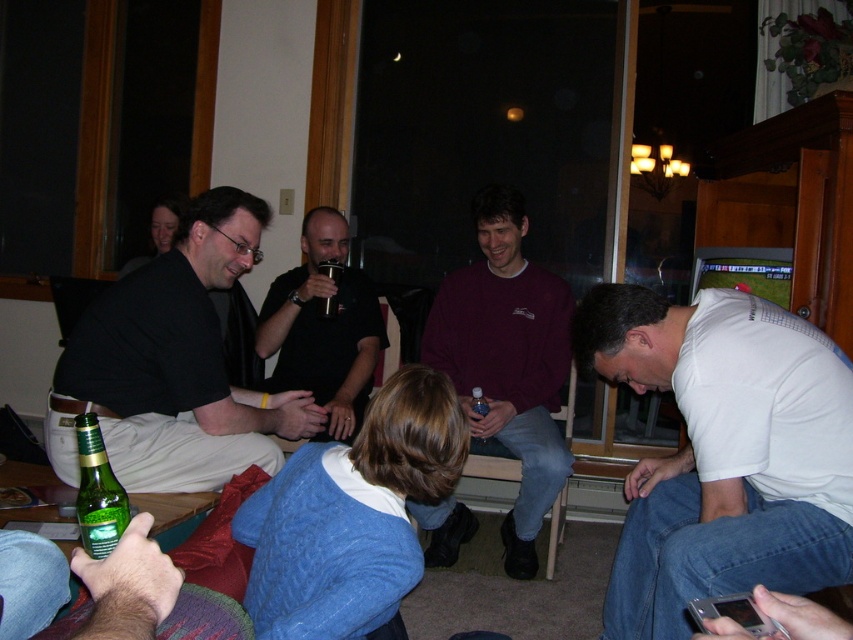
Locate an element on the screen. green glass bottle at lower left is located at coordinates click(x=97, y=492).

Can you confirm if green glass bottle at lower left is positioned below clear plastic water bottle at center?

No, green glass bottle at lower left is not below clear plastic water bottle at center.

Who is more forward, (125, 509) or (479, 400)?

Point (125, 509) is more forward.

The image size is (853, 640). Find the location of `green glass bottle at lower left`. green glass bottle at lower left is located at coordinates (97, 492).

The image size is (853, 640). What do you see at coordinates (724, 452) in the screenshot?
I see `white matte shirt at lower right` at bounding box center [724, 452].

Is white matte shirt at lower right to the right of clear plastic water bottle at center from the viewer's perspective?

Correct, you'll find white matte shirt at lower right to the right of clear plastic water bottle at center.

Which is behind, point (625, 378) or point (479, 390)?

Positioned behind is point (479, 390).

You are a GUI agent. You are given a task and a screenshot of the screen. Output one action in this format:
    pyautogui.click(x=<x>, y=<y>)
    Task: Click on the white matte shirt at lower right
    
    Given the screenshot: What is the action you would take?
    pyautogui.click(x=724, y=452)

Can you confirm if maroon sweater at center is positioned to the left of clear plastic water bottle at center?

In fact, maroon sweater at center is to the right of clear plastic water bottle at center.

Which is behind, point (524, 440) or point (480, 417)?

Positioned behind is point (480, 417).

The height and width of the screenshot is (640, 853). I want to click on maroon sweater at center, so click(x=508, y=360).